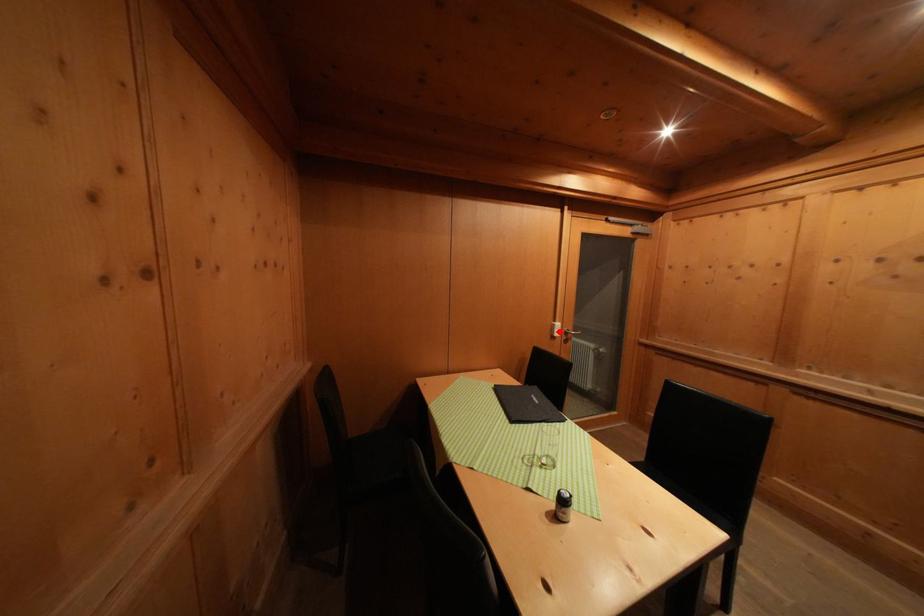
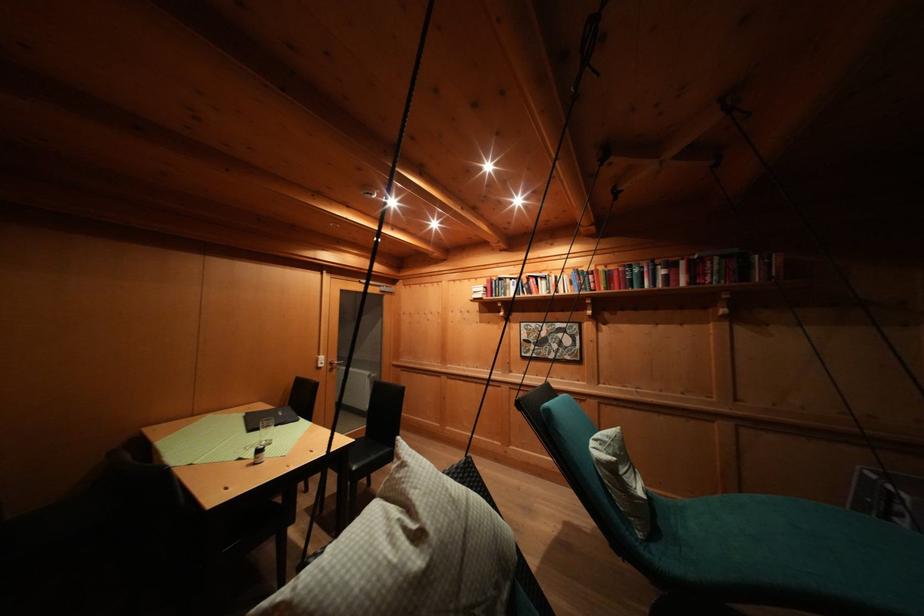
Where in the second image is the point corresponding to the highlighted location from the first image?

(323, 363)